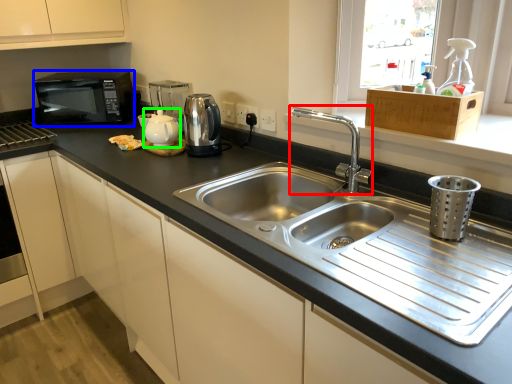
Question: Which is farther away from tap (highlighted by a red box)? microwave oven (highlighted by a blue box) or tea pot (highlighted by a green box)?

Choices:
 (A) microwave oven
 (B) tea pot

Answer: (A)